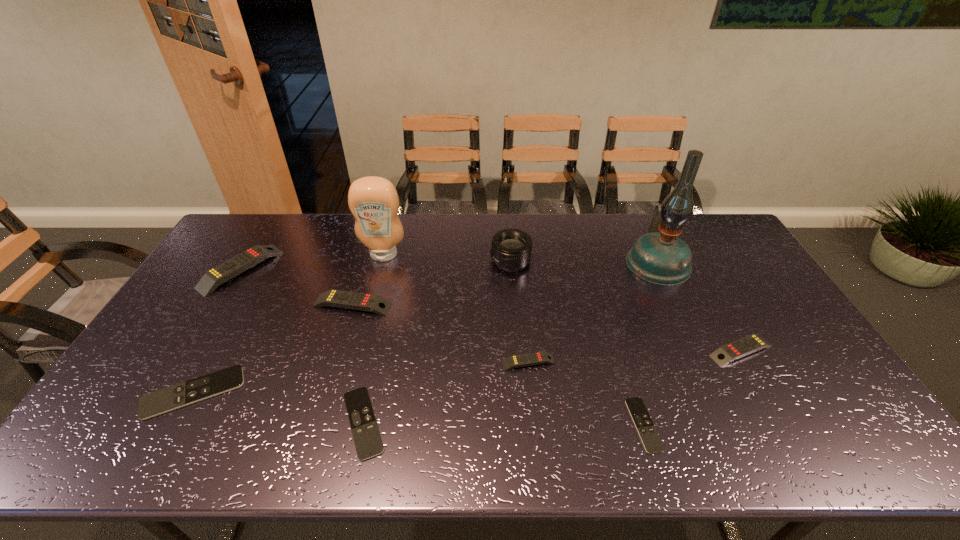
The image size is (960, 540). I want to click on vacant area situated 0.180m on the side of the eighth shortest object with brand markings and control switches, so click(438, 261).

At what (x,y) coordinates should I click in order to perform the action: click on free space located on the side of the eighth shortest object with brand markings and control switches. Please return your answer as a coordinate pair (x, y). The height and width of the screenshot is (540, 960). Looking at the image, I should click on (400, 261).

Where is `vacant space located 0.070m on the right of the seventh shortest object`? The height and width of the screenshot is (540, 960). vacant space located 0.070m on the right of the seventh shortest object is located at coordinates tap(296, 269).

The image size is (960, 540). What are the coordinates of `vacant point located 0.050m on the front of the sixth shortest object` in the screenshot? It's located at (346, 328).

In order to click on free spot located 0.130m on the left of the fifth shortest object in this screenshot , I will do `click(660, 350)`.

In order to click on blank space located on the back of the second yellow remote control from right to left in this screenshot , I will do `click(520, 279)`.

Image resolution: width=960 pixels, height=540 pixels. I want to click on vacant region located on the back of the biggest black remote control, so click(238, 313).

This screenshot has width=960, height=540. Identify the location of free space located on the right of the second smallest black remote control. (495, 423).

At what (x,y) coordinates should I click in order to perform the action: click on free space located on the back of the shortest object. Please return your answer as a coordinate pair (x, y). Looking at the image, I should click on (605, 294).

Identify the location of oil lamp at the far edge. (660, 257).